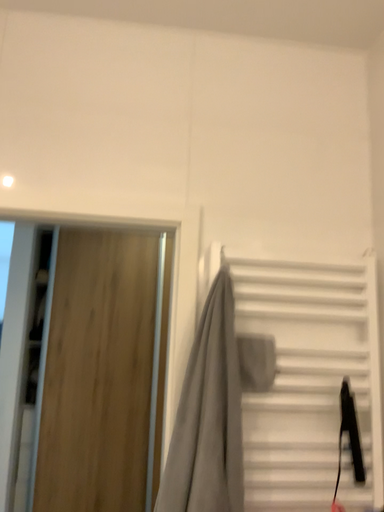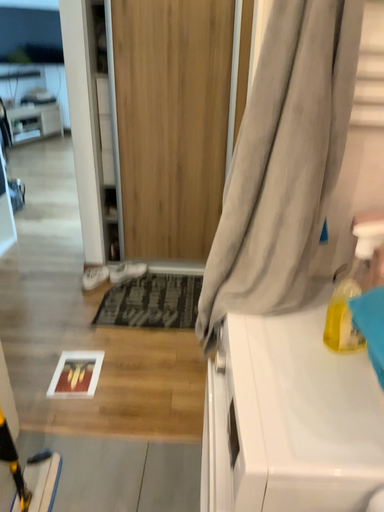
Question: Which way did the camera rotate in the video?

Choices:
 (A) rotated right
 (B) rotated left

Answer: (B)